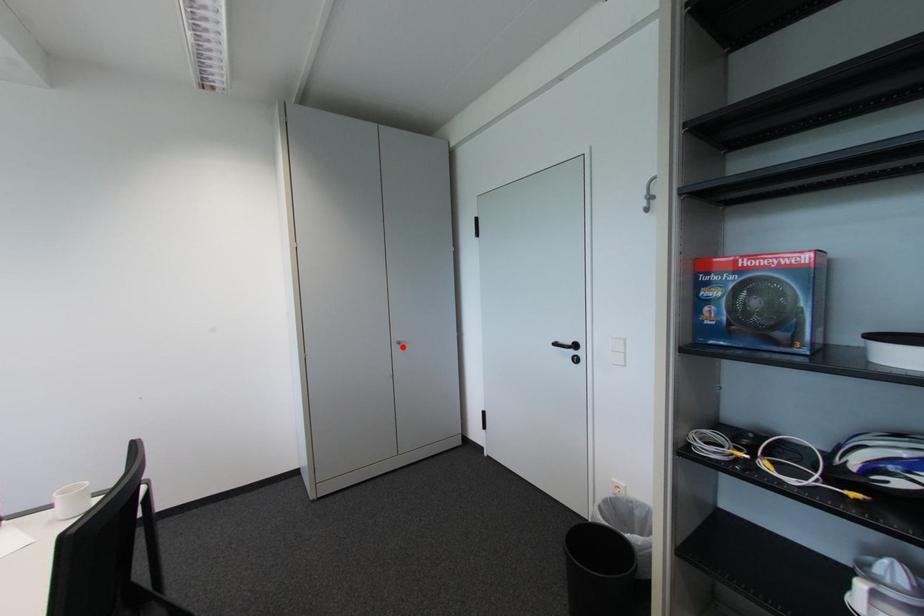
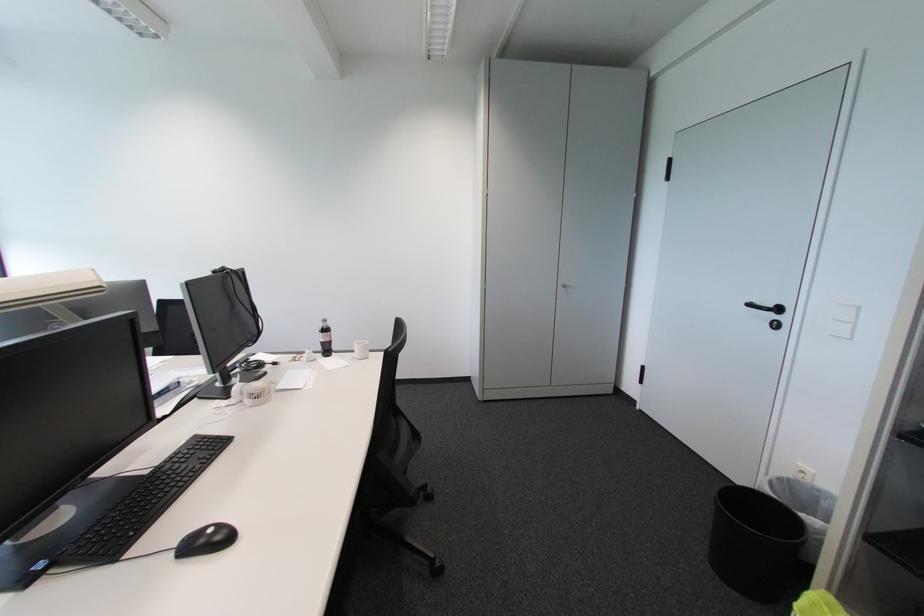
The point at the highlighted location is marked in the first image. Where is the corresponding point in the second image?

(567, 290)